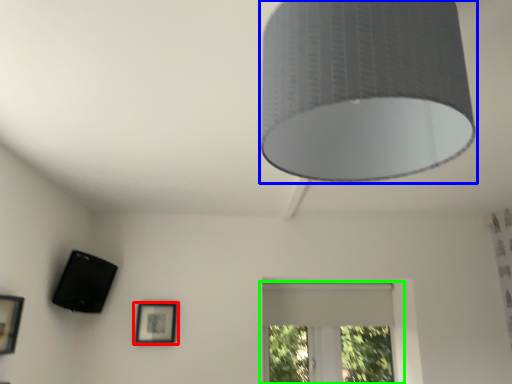
Question: Which is farther away from picture frame (highlighted by a red box)? lamp (highlighted by a blue box) or window (highlighted by a green box)?

Choices:
 (A) lamp
 (B) window

Answer: (A)